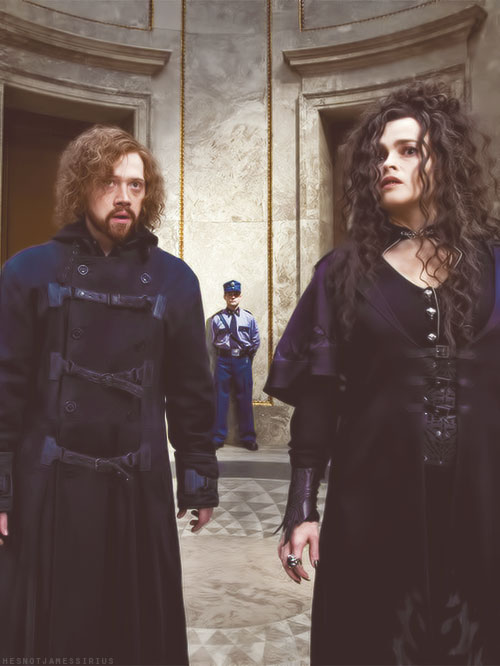
The image size is (500, 666). Find the location of `floor`. floor is located at coordinates (245, 575).